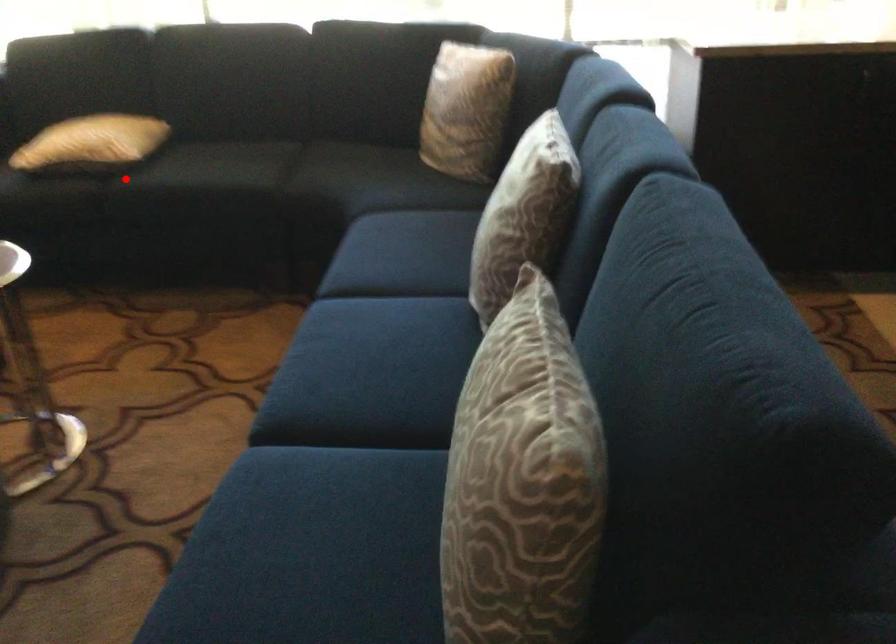
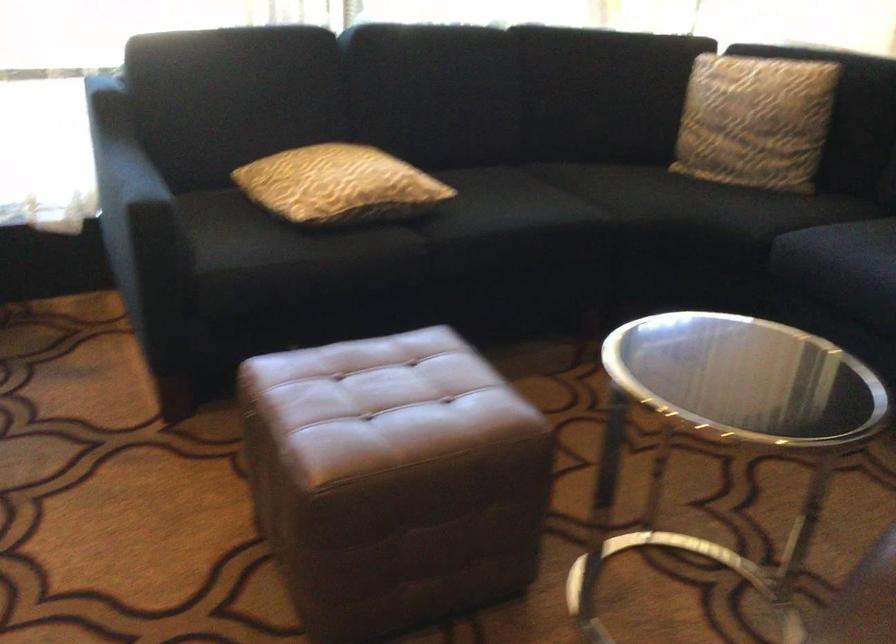
Question: A red point is marked in image1. In image2, is the corresponding 3D point closer to the camera or farther? Reply with the corresponding letter.

Choices:
 (A) The corresponding 3D point is closer.
 (B) The corresponding 3D point is farther.

Answer: (A)